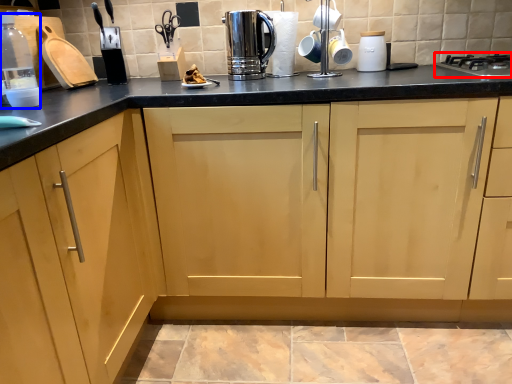
Question: Which object is closer to the camera taking this photo, home appliance (highlighted by a red box) or bottle (highlighted by a blue box)?

Choices:
 (A) home appliance
 (B) bottle

Answer: (B)